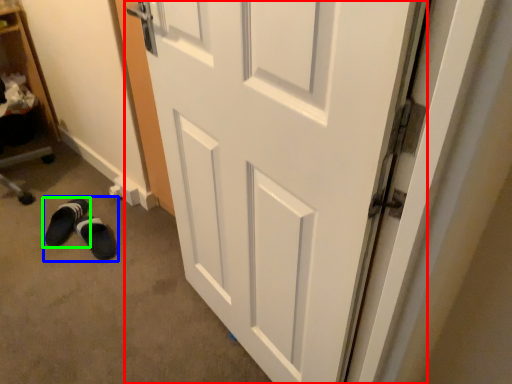
Question: Based on their relative distances, which object is nearer to door (highlighted by a red box)? Choose from shoe (highlighted by a blue box) and footwear (highlighted by a green box).

Choices:
 (A) shoe
 (B) footwear

Answer: (A)